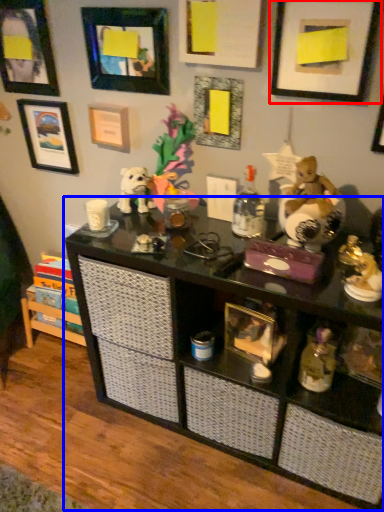
Question: Which object is further to the camera taking this photo, picture frame (highlighted by a red box) or shelf (highlighted by a blue box)?

Choices:
 (A) picture frame
 (B) shelf

Answer: (A)